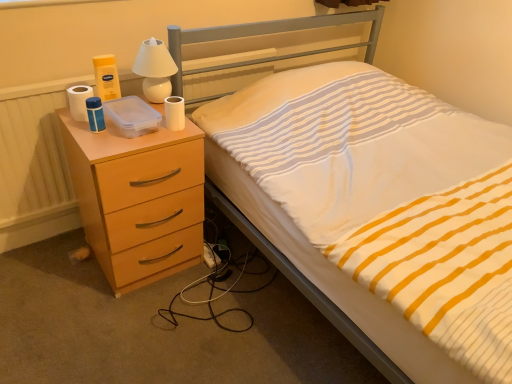
Question: Should I look upward or downward to see white glossy lamp at upper center?

Choices:
 (A) up
 (B) down

Answer: (A)

Question: Is white matte toilet paper at left, acting as the 1th toilet paper starting from the left, located outside white glossy lamp at upper center?

Choices:
 (A) yes
 (B) no

Answer: (A)

Question: Is white matte toilet paper at left, which ranks as the second toilet paper in right-to-left order, shorter than white glossy lamp at upper center?

Choices:
 (A) no
 (B) yes

Answer: (B)

Question: From the image's perspective, would you say white matte toilet paper at left, acting as the 1th toilet paper starting from the left, is positioned over white glossy lamp at upper center?

Choices:
 (A) no
 (B) yes

Answer: (A)

Question: Considering the relative positions of white matte toilet paper at left, acting as the 1th toilet paper starting from the left, and white glossy lamp at upper center in the image provided, is white matte toilet paper at left, acting as the 1th toilet paper starting from the left, to the left of white glossy lamp at upper center from the viewer's perspective?

Choices:
 (A) no
 (B) yes

Answer: (B)

Question: From a real-world perspective, is white matte toilet paper at left, acting as the 1th toilet paper starting from the left, physically below white glossy lamp at upper center?

Choices:
 (A) yes
 (B) no

Answer: (A)

Question: From a real-world perspective, is white matte toilet paper at left, which ranks as the second toilet paper in right-to-left order, over white glossy lamp at upper center?

Choices:
 (A) no
 (B) yes

Answer: (A)

Question: From the image's perspective, is white glossy lamp at upper center located beneath white matte toilet paper at upper right, which is counted as the 2th toilet paper, starting from the left?

Choices:
 (A) yes
 (B) no

Answer: (B)

Question: Could you tell me if white glossy lamp at upper center is turned towards white matte toilet paper at upper right, the 1th toilet paper from the right?

Choices:
 (A) yes
 (B) no

Answer: (A)

Question: Is white glossy lamp at upper center smaller than white matte toilet paper at upper right, which is counted as the 2th toilet paper, starting from the left?

Choices:
 (A) no
 (B) yes

Answer: (A)

Question: Is white glossy lamp at upper center bigger than white matte toilet paper at upper right, which is counted as the 2th toilet paper, starting from the left?

Choices:
 (A) no
 (B) yes

Answer: (B)

Question: Is white glossy lamp at upper center at the left side of white matte toilet paper at upper right, which is counted as the 2th toilet paper, starting from the left?

Choices:
 (A) yes
 (B) no

Answer: (A)

Question: Does white glossy lamp at upper center have a lesser height compared to white matte toilet paper at upper right, which is counted as the 2th toilet paper, starting from the left?

Choices:
 (A) yes
 (B) no

Answer: (B)

Question: Is white matte toilet paper at upper right, the 1th toilet paper from the right, completely or partially outside of white glossy lamp at upper center?

Choices:
 (A) no
 (B) yes

Answer: (B)